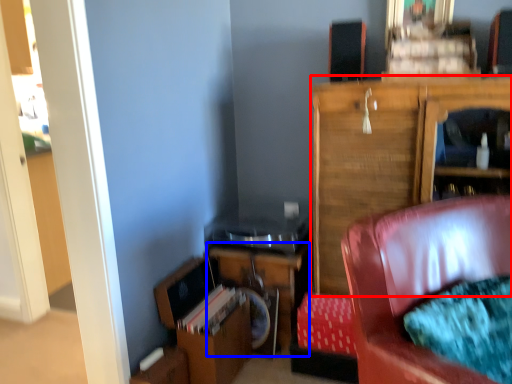
Question: Which object is further to the camera taking this photo, cabinetry (highlighted by a red box) or table (highlighted by a blue box)?

Choices:
 (A) cabinetry
 (B) table

Answer: (B)